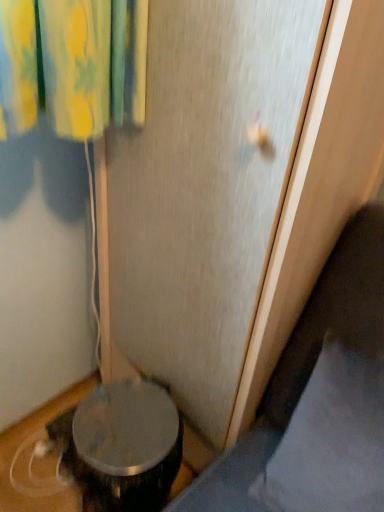
Question: Should I look upward or downward to see transparent plastic screen door at center?

Choices:
 (A) down
 (B) up

Answer: (A)

Question: Does gray fabric pillow at lower right have a smaller size compared to transparent plastic screen door at center?

Choices:
 (A) no
 (B) yes

Answer: (B)

Question: Would you say gray fabric pillow at lower right contains transparent plastic screen door at center?

Choices:
 (A) yes
 (B) no

Answer: (B)

Question: Is gray fabric pillow at lower right further to camera compared to transparent plastic screen door at center?

Choices:
 (A) yes
 (B) no

Answer: (A)

Question: Is the depth of gray fabric pillow at lower right less than that of transparent plastic screen door at center?

Choices:
 (A) yes
 (B) no

Answer: (B)

Question: Can you confirm if gray fabric pillow at lower right is positioned to the left of transparent plastic screen door at center?

Choices:
 (A) no
 (B) yes

Answer: (A)

Question: From a real-world perspective, is gray fabric pillow at lower right located beneath transparent plastic screen door at center?

Choices:
 (A) no
 (B) yes

Answer: (B)

Question: Is transparent plastic screen door at center outside of gray fabric pillow at lower right?

Choices:
 (A) yes
 (B) no

Answer: (A)

Question: Is transparent plastic screen door at center oriented away from gray fabric pillow at lower right?

Choices:
 (A) yes
 (B) no

Answer: (B)

Question: Is transparent plastic screen door at center far away from gray fabric pillow at lower right?

Choices:
 (A) no
 (B) yes

Answer: (A)

Question: Is transparent plastic screen door at center taller than gray fabric pillow at lower right?

Choices:
 (A) yes
 (B) no

Answer: (A)

Question: Can you confirm if transparent plastic screen door at center is smaller than gray fabric pillow at lower right?

Choices:
 (A) no
 (B) yes

Answer: (A)

Question: Does transparent plastic screen door at center come behind gray fabric pillow at lower right?

Choices:
 (A) no
 (B) yes

Answer: (A)

Question: Is transparent plastic screen door at center in front of or behind gray fabric pillow at lower right in the image?

Choices:
 (A) behind
 (B) front

Answer: (B)